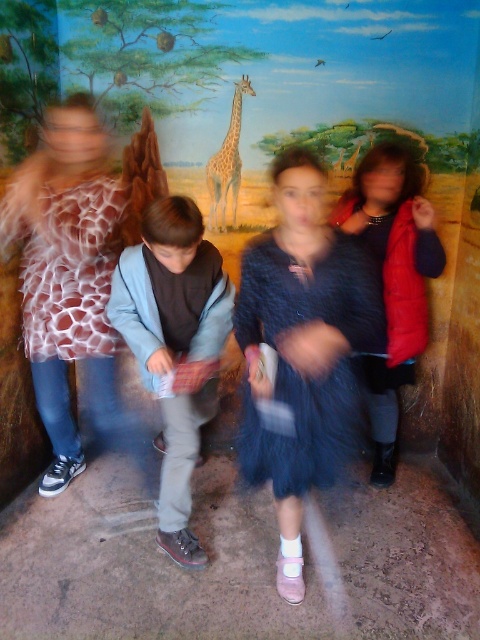
Question: Which object is the closest to the velvet red vest at right?

Choices:
 (A) light blue denim jacket at center
 (B) velvet blue dress at center
 (C) spotted fur giraffe at center

Answer: (B)

Question: Which point is farther to the camera?

Choices:
 (A) light blue denim jacket at center
 (B) velvet red vest at right
 (C) velvet blue dress at center
 (D) spotted fur giraffe at center

Answer: (D)

Question: From the image, what is the correct spatial relationship of velvet blue dress at center in relation to light blue denim jacket at center?

Choices:
 (A) below
 (B) above

Answer: (B)

Question: Does light blue denim jacket at center have a greater width compared to velvet red vest at right?

Choices:
 (A) yes
 (B) no

Answer: (A)

Question: Is light blue denim jacket at center positioned before velvet red vest at right?

Choices:
 (A) yes
 (B) no

Answer: (A)

Question: Which point is closer to the camera?

Choices:
 (A) spotted fur giraffe at center
 (B) velvet red vest at right
 (C) velvet blue dress at center
 (D) light blue denim jacket at center

Answer: (C)